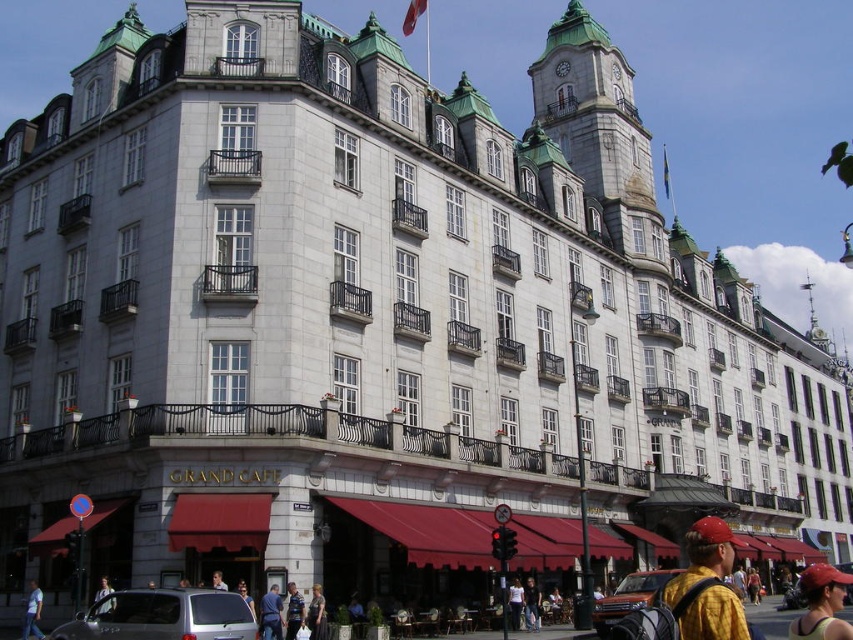
Between silver metallic van at lower left and denim jacket at lower right, which one is positioned higher?

silver metallic van at lower left

Measure the distance between point (112, 609) and camera.

They are 37.50 meters apart.

Locate an element on the screen. The image size is (853, 640). silver metallic van at lower left is located at coordinates click(161, 616).

Is white cotton shirt at center wider than light brown leather jacket at lower center?

Incorrect, white cotton shirt at center's width does not surpass light brown leather jacket at lower center's.

Between white cotton shirt at center and light brown leather jacket at lower center, which one has more height?

Standing taller between the two is light brown leather jacket at lower center.

Between point (515, 608) and point (239, 582), which one is positioned behind?

The point (515, 608) is more distant.

Where is `white cotton shirt at center`? white cotton shirt at center is located at coordinates pyautogui.click(x=515, y=604).

Is point (822, 577) positioned behind point (668, 164)?

No, (822, 577) is closer to viewer.

Is point (843, 577) in front of point (664, 157)?

Yes, it is.

Between point (836, 593) and point (665, 180), which one is positioned in front?

Point (836, 593) is in front.

Find the location of a particular element. The width and height of the screenshot is (853, 640). red cap at center is located at coordinates (821, 604).